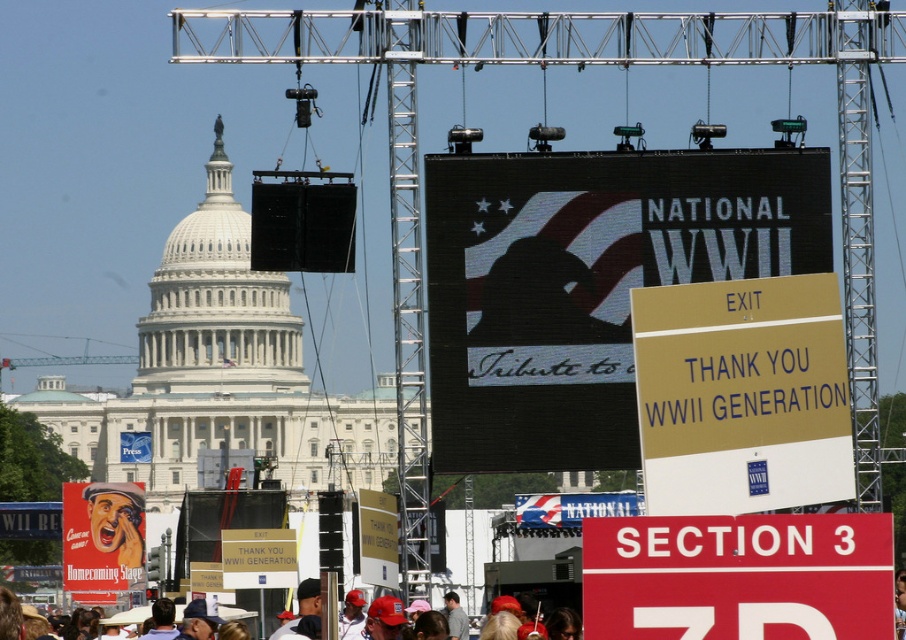
You are attending a public event at the United States Capitol and want to locate the metallic helmet at center. You see the red plastic sign at lower right. Which object is closer to you?

The red plastic sign at lower right is closer to the viewer than the metallic helmet at center.

You are a photographer at the event and want to capture both the red plastic sign at lower right and the metallic helmet at center in a single frame. Based on their sizes, is it possible to include both in the shot without zooming in or out?

The red plastic sign at lower right might be wider than metallic helmet at center, so it depends on the camera angle and distance. If the photographer positions themselves far enough back, both objects could fit within the frame.

You are standing at the center of the event in front of the United States Capitol building. You want to locate the black matte scoreboard at upper center. According to the coordinates provided, where should you look to find it?

The black matte scoreboard at upper center is located at point coordinates of (586, 284).